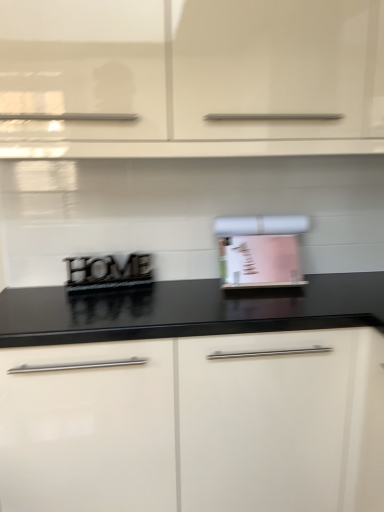
Question: Which direction should I rotate to face pink paper towel holder at center, the first appliance viewed from the right, — up or down?

Choices:
 (A) down
 (B) up

Answer: (A)

Question: Does metallic black sign at center, which ranks as the second appliance in right-to-left order, come behind pink paper towel holder at center, the first appliance viewed from the right?

Choices:
 (A) yes
 (B) no

Answer: (A)

Question: Does metallic black sign at center, the first appliance when ordered from left to right, have a smaller size compared to pink paper towel holder at center, the first appliance viewed from the right?

Choices:
 (A) yes
 (B) no

Answer: (A)

Question: Is metallic black sign at center, which ranks as the second appliance in right-to-left order, at the left side of pink paper towel holder at center, the first appliance viewed from the right?

Choices:
 (A) yes
 (B) no

Answer: (A)

Question: Can you confirm if metallic black sign at center, the first appliance when ordered from left to right, is wider than pink paper towel holder at center, which appears as the 2th appliance when viewed from the left?

Choices:
 (A) yes
 (B) no

Answer: (B)

Question: Considering the relative sizes of metallic black sign at center, which ranks as the second appliance in right-to-left order, and pink paper towel holder at center, which appears as the 2th appliance when viewed from the left, in the image provided, is metallic black sign at center, which ranks as the second appliance in right-to-left order, taller than pink paper towel holder at center, which appears as the 2th appliance when viewed from the left,?

Choices:
 (A) yes
 (B) no

Answer: (B)

Question: Does metallic black sign at center, which ranks as the second appliance in right-to-left order, touch pink paper towel holder at center, which appears as the 2th appliance when viewed from the left?

Choices:
 (A) yes
 (B) no

Answer: (B)

Question: Is metallic black sign at center, the first appliance when ordered from left to right, thinner than white glossy cabinet at center, the 1th cabinetry when ordered from bottom to top?

Choices:
 (A) yes
 (B) no

Answer: (A)

Question: Is metallic black sign at center, which ranks as the second appliance in right-to-left order, closer to the viewer compared to white glossy cabinet at center, the 1th cabinetry when ordered from bottom to top?

Choices:
 (A) yes
 (B) no

Answer: (B)

Question: Is metallic black sign at center, which ranks as the second appliance in right-to-left order, touching white glossy cabinet at center, the 1th cabinetry when ordered from bottom to top?

Choices:
 (A) no
 (B) yes

Answer: (A)

Question: Can you confirm if metallic black sign at center, which ranks as the second appliance in right-to-left order, is positioned to the left of white glossy cabinet at center, the 1th cabinetry when ordered from bottom to top?

Choices:
 (A) yes
 (B) no

Answer: (A)

Question: From the image's perspective, is metallic black sign at center, the first appliance when ordered from left to right, located above white glossy cabinet at center, placed as the second cabinetry when sorted from top to bottom?

Choices:
 (A) no
 (B) yes

Answer: (B)

Question: Considering the relative sizes of metallic black sign at center, which ranks as the second appliance in right-to-left order, and white glossy cabinet at center, placed as the second cabinetry when sorted from top to bottom, in the image provided, is metallic black sign at center, which ranks as the second appliance in right-to-left order, wider than white glossy cabinet at center, placed as the second cabinetry when sorted from top to bottom,?

Choices:
 (A) no
 (B) yes

Answer: (A)

Question: Considering the relative sizes of pink paper towel holder at center, the first appliance viewed from the right, and white glossy cabinet at upper center, placed as the 2th cabinetry when sorted from bottom to top, in the image provided, is pink paper towel holder at center, the first appliance viewed from the right, taller than white glossy cabinet at upper center, placed as the 2th cabinetry when sorted from bottom to top,?

Choices:
 (A) yes
 (B) no

Answer: (B)